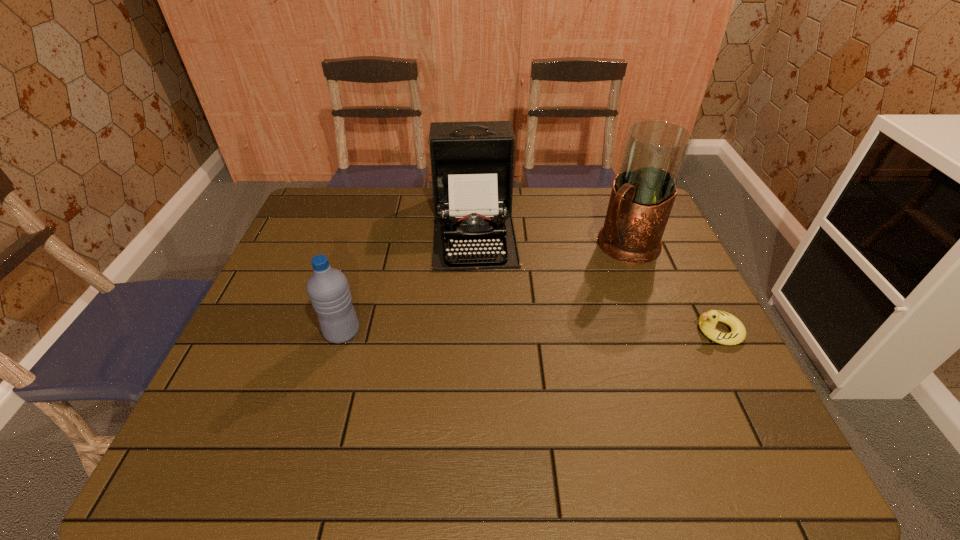
The height and width of the screenshot is (540, 960). I want to click on vacant space that is in between the pitcher and the water bottle, so click(x=484, y=289).

This screenshot has height=540, width=960. What are the coordinates of `vacant space in between the duckling and the tallest object` in the screenshot? It's located at (672, 288).

Image resolution: width=960 pixels, height=540 pixels. Identify the location of unoccupied area between the pitcher and the second object from left to right. (550, 237).

Identify the location of vacant space that is in between the duckling and the leftmost object. (530, 332).

Find the location of a particular element. The image size is (960, 540). free space between the pitcher and the water bottle is located at coordinates (484, 289).

Identify the location of object that is the closest to the third tallest object. (472, 163).

Find the location of a particular element. The height and width of the screenshot is (540, 960). object that stands as the second closest to the third object from right to left is located at coordinates (328, 289).

Locate an element on the screen. This screenshot has width=960, height=540. free space that satisfies the following two spatial constraints: 1. on the back side of the third tallest object; 2. on the face of the shortest object is located at coordinates (343, 330).

Identify the location of vacant space that satisfies the following two spatial constraints: 1. on the back side of the tallest object; 2. on the right side of the third tallest object. (368, 246).

I want to click on vacant space that satisfies the following two spatial constraints: 1. on the back side of the shortest object; 2. on the face of the water bottle, so (x=343, y=330).